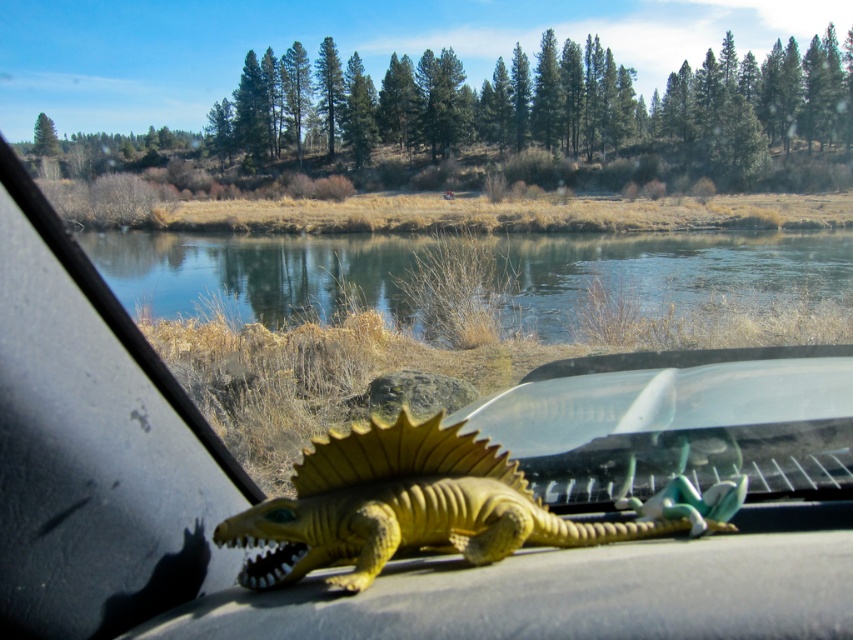
Question: Is clear blue water at center further to the viewer compared to yellow matte plastic dinosaur at center?

Choices:
 (A) no
 (B) yes

Answer: (B)

Question: Which of the following is the farthest from the observer?

Choices:
 (A) (721, 518)
 (B) (572, 333)

Answer: (B)

Question: Which point appears closest to the camera in this image?

Choices:
 (A) (254, 589)
 (B) (189, 234)

Answer: (A)

Question: Does clear blue water at center have a larger size compared to yellow matte plastic dinosaur at center?

Choices:
 (A) yes
 (B) no

Answer: (A)

Question: Is clear blue water at center below yellow matte plastic dinosaur at center?

Choices:
 (A) no
 (B) yes

Answer: (A)